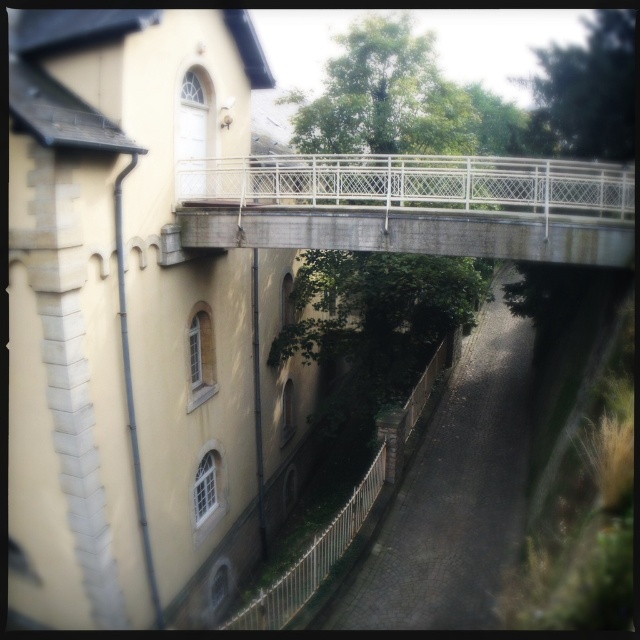
Question: Observing the image, what is the correct spatial positioning of green leafy tree at upper right in reference to white metal fence at lower center?

Choices:
 (A) above
 (B) below

Answer: (A)

Question: Does concrete/rustic bridge at center have a smaller size compared to green leafy tree at center?

Choices:
 (A) no
 (B) yes

Answer: (A)

Question: Among these points, which one is farthest from the camera?

Choices:
 (A) (358, 188)
 (B) (408, 33)

Answer: (B)

Question: Which point is farther to the camera?

Choices:
 (A) (364, 163)
 (B) (435, 358)
 (C) (413, 124)

Answer: (B)

Question: Considering the real-world distances, which object is farthest from the white metal fence at lower center?

Choices:
 (A) green leafy tree at upper right
 (B) concrete/rustic bridge at center
 (C) green leafy tree at center

Answer: (C)

Question: Can you confirm if concrete/rustic bridge at center is positioned to the right of green leafy tree at upper right?

Choices:
 (A) yes
 (B) no

Answer: (B)